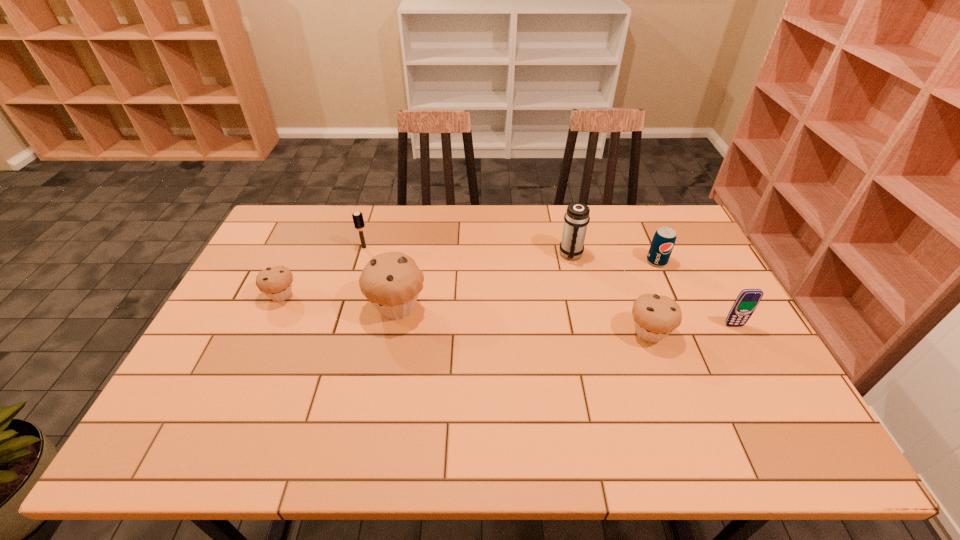
Find the location of a particular element. The image size is (960, 540). free space between the leftmost object and the pop is located at coordinates (468, 278).

You are a GUI agent. You are given a task and a screenshot of the screen. Output one action in this format:
    pyautogui.click(x=<x>, y=<y>)
    Task: Click on the free area in between the fourth object from left to right and the sixth object from right to left
    
    Given the screenshot: What is the action you would take?
    pyautogui.click(x=468, y=251)

Locate an element on the screen. free spot between the hairbrush and the sixth object from left to right is located at coordinates (511, 254).

Where is `empty location between the hairbrush and the rightmost muffin`? This screenshot has width=960, height=540. empty location between the hairbrush and the rightmost muffin is located at coordinates (507, 290).

I want to click on free spot between the tallest muffin and the pop, so click(527, 284).

I want to click on free space that is in between the fifth object from left to right and the hairbrush, so click(x=507, y=290).

Locate an element on the screen. object that stands as the third closest to the pop is located at coordinates (745, 304).

At what (x,y) coordinates should I click in order to perform the action: click on the second closest object to the leftmost muffin. Please return your answer as a coordinate pair (x, y). The height and width of the screenshot is (540, 960). Looking at the image, I should click on (391, 281).

Find the location of `muffin that is the closest to the third object from left to right`. muffin that is the closest to the third object from left to right is located at coordinates (276, 282).

I want to click on muffin that stands as the closest to the fifth object from left to right, so click(x=391, y=281).